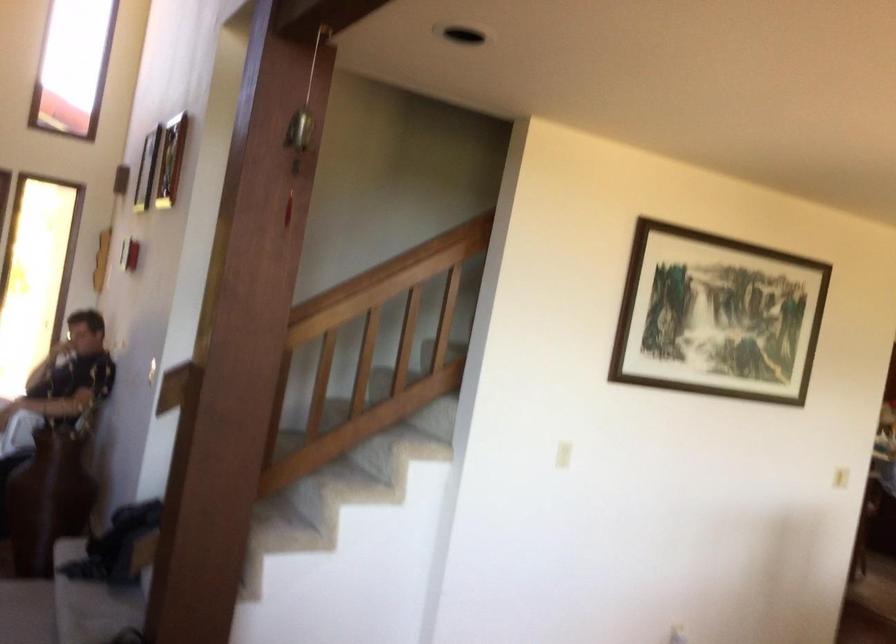
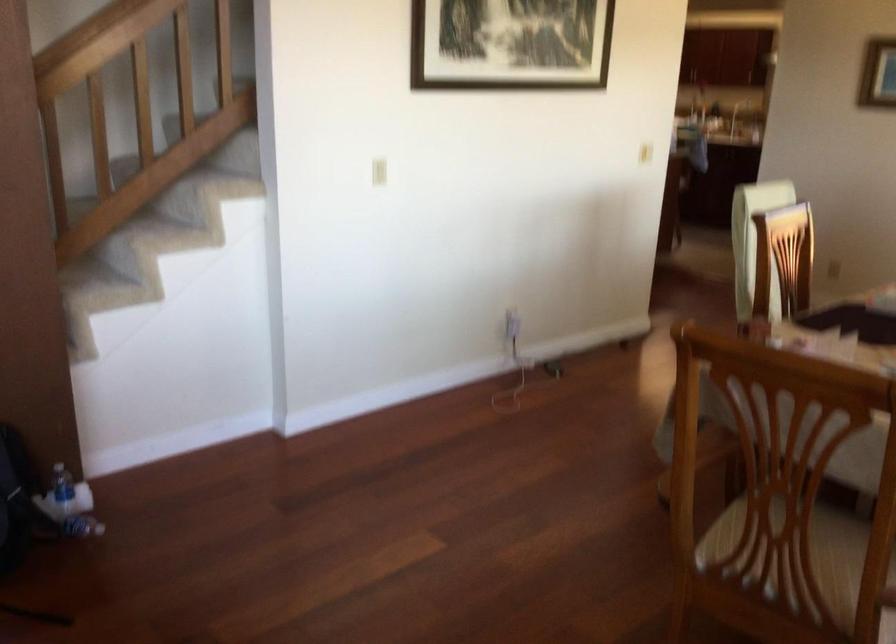
Question: In a continuous first-person perspective shot, in which direction is the camera moving?

Choices:
 (A) Left
 (B) Right
 (C) Forward
 (D) Backward

Answer: (A)